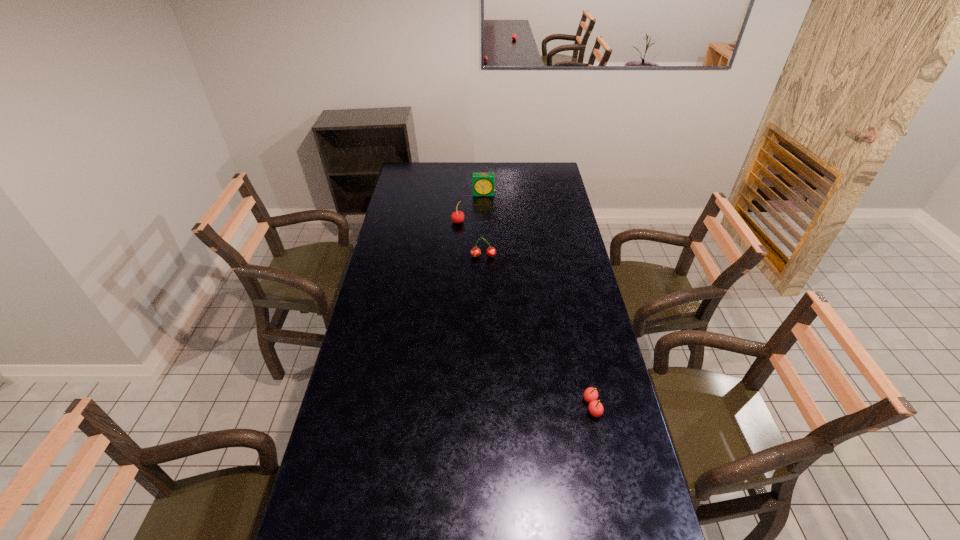
The width and height of the screenshot is (960, 540). Identify the location of free spot between the farthest cherry and the third farthest object. (470, 239).

This screenshot has width=960, height=540. Identify the location of free space between the farthest object and the second cherry from right to left. (484, 225).

You are a GUI agent. You are given a task and a screenshot of the screen. Output one action in this format:
    pyautogui.click(x=<x>, y=<y>)
    Task: Click on the vacant area that lies between the second cherry from left to right and the shortest cherry
    This screenshot has height=540, width=960.
    Given the screenshot: What is the action you would take?
    pyautogui.click(x=538, y=332)

Identify the location of free area in between the second nearest cherry and the second farthest object. (470, 239).

Locate an element on the screen. The height and width of the screenshot is (540, 960). free space between the alarm clock and the second nearest cherry is located at coordinates (484, 225).

Locate an element on the screen. This screenshot has height=540, width=960. empty location between the second cherry from right to left and the farthest cherry is located at coordinates (470, 239).

Image resolution: width=960 pixels, height=540 pixels. Identify the location of object that is the second closest to the shortest object. (458, 216).

Where is `object that stands as the second closest to the second cherry from left to right`? This screenshot has width=960, height=540. object that stands as the second closest to the second cherry from left to right is located at coordinates (483, 183).

Identify the location of the second closest cherry relative to the rightmost cherry. coord(458,216).

The width and height of the screenshot is (960, 540). What are the coordinates of `cherry that can be found as the third closest to the alarm clock` in the screenshot? It's located at (596, 409).